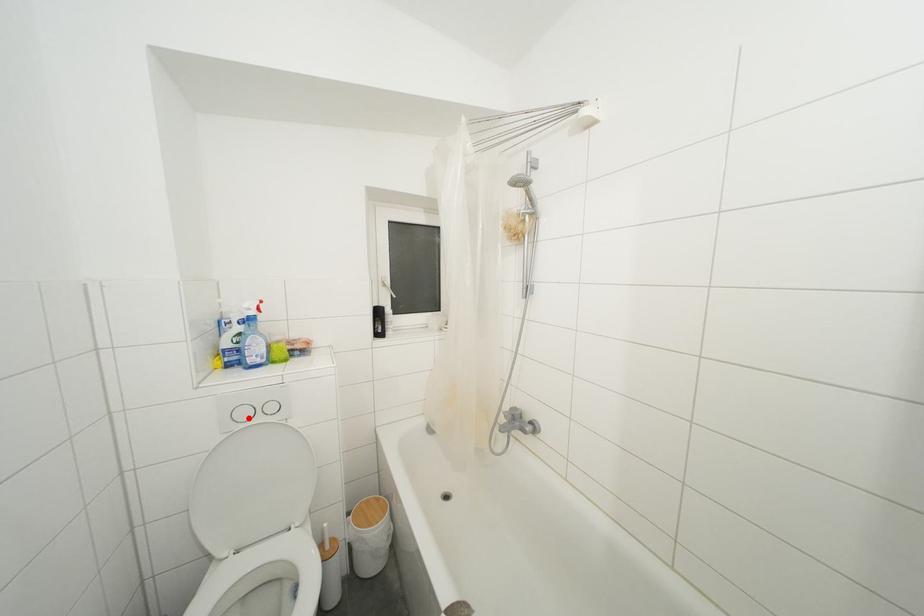
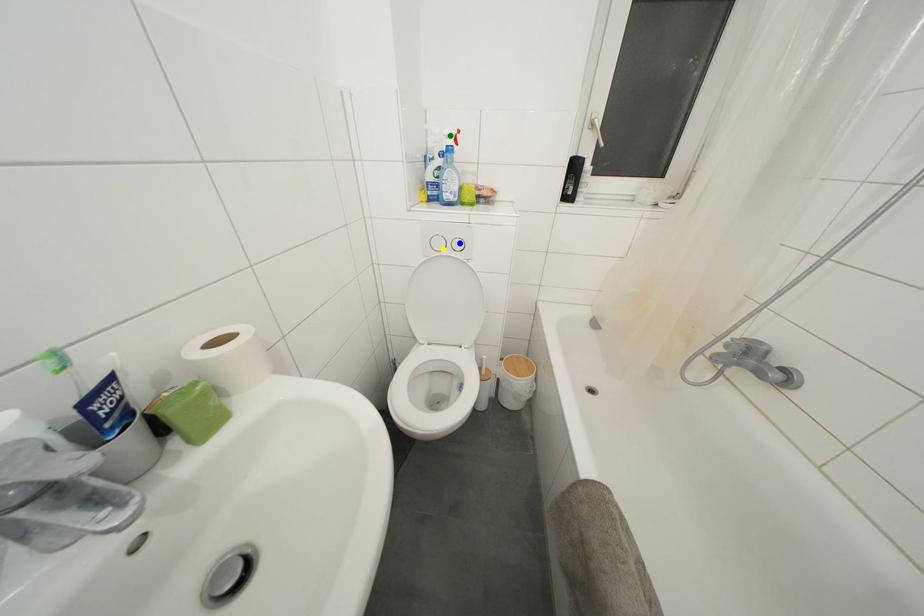
Question: I am providing you with two images of the same scene from different viewpoints. A red point is marked on the first image. You are given multiple points on the second image. In image 2, which mark is for the same physical point as the one in image 1?

Choices:
 (A) yellow point
 (B) blue point
 (C) green point

Answer: (A)